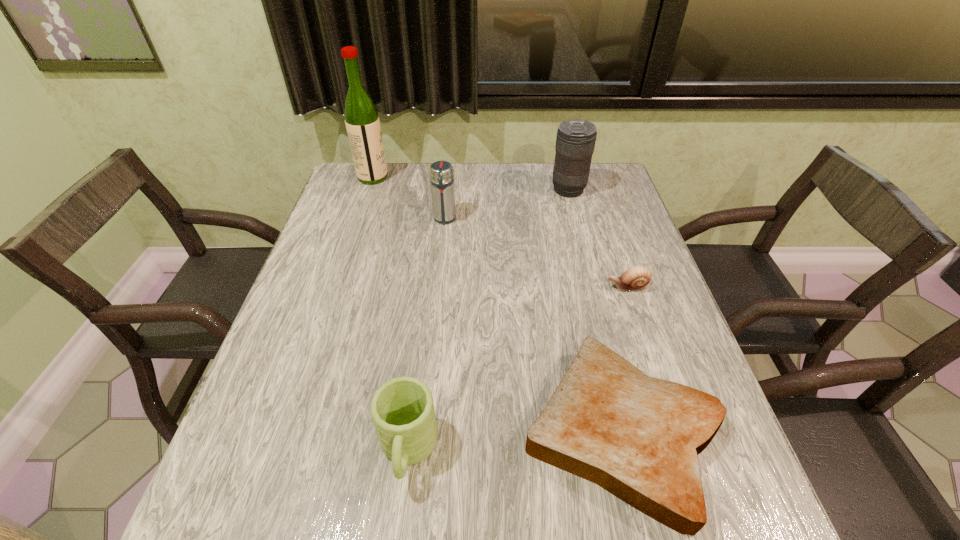
This screenshot has height=540, width=960. Identify the location of vacant space that satisfies the following two spatial constraints: 1. on the label of the bread; 2. on the left side of the liquor. (290, 431).

The width and height of the screenshot is (960, 540). I want to click on vacant area in the image that satisfies the following two spatial constraints: 1. with a handle on the side of the bread; 2. on the left side of the third farthest object, so click(x=424, y=431).